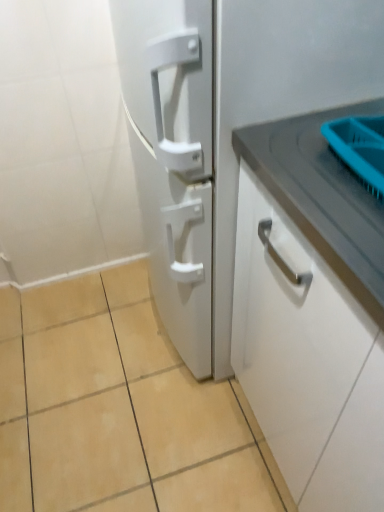
Question: Would you say white matte cabinet handle at right is a long distance from white matte refrigerator at center?

Choices:
 (A) no
 (B) yes

Answer: (A)

Question: From the image's perspective, is white matte cabinet handle at right above white matte refrigerator at center?

Choices:
 (A) yes
 (B) no

Answer: (B)

Question: From a real-world perspective, is white matte cabinet handle at right beneath white matte refrigerator at center?

Choices:
 (A) no
 (B) yes

Answer: (B)

Question: Is white matte cabinet handle at right with white matte refrigerator at center?

Choices:
 (A) no
 (B) yes

Answer: (A)

Question: Is white matte cabinet handle at right not within white matte refrigerator at center?

Choices:
 (A) no
 (B) yes

Answer: (B)

Question: Is white matte refrigerator at center to the left or to the right of beige ceramic tile at lower center in the image?

Choices:
 (A) left
 (B) right

Answer: (B)

Question: From the image's perspective, is white matte refrigerator at center positioned above or below beige ceramic tile at lower center?

Choices:
 (A) above
 (B) below

Answer: (A)

Question: Would you say white matte refrigerator at center is inside or outside beige ceramic tile at lower center?

Choices:
 (A) inside
 (B) outside

Answer: (B)

Question: In the image, is white matte refrigerator at center positioned in front of or behind beige ceramic tile at lower center?

Choices:
 (A) front
 (B) behind

Answer: (A)

Question: From a real-world perspective, is beige ceramic tile at lower center physically located above or below white matte cabinet handle at right?

Choices:
 (A) above
 (B) below

Answer: (B)

Question: Considering the relative positions of beige ceramic tile at lower center and white matte cabinet handle at right in the image provided, is beige ceramic tile at lower center to the left or to the right of white matte cabinet handle at right?

Choices:
 (A) left
 (B) right

Answer: (A)

Question: Is beige ceramic tile at lower center situated inside white matte cabinet handle at right or outside?

Choices:
 (A) outside
 (B) inside

Answer: (A)

Question: In terms of width, does beige ceramic tile at lower center look wider or thinner when compared to white matte cabinet handle at right?

Choices:
 (A) thin
 (B) wide

Answer: (B)

Question: From the image's perspective, is white matte cabinet handle at right above or below white matte refrigerator at center?

Choices:
 (A) above
 (B) below

Answer: (B)

Question: In terms of width, does white matte cabinet handle at right look wider or thinner when compared to white matte refrigerator at center?

Choices:
 (A) wide
 (B) thin

Answer: (B)